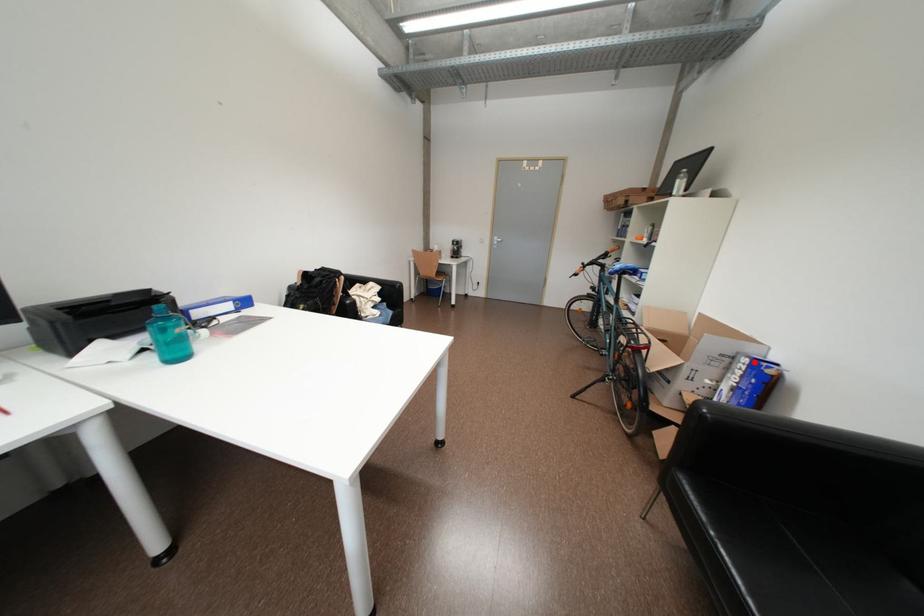
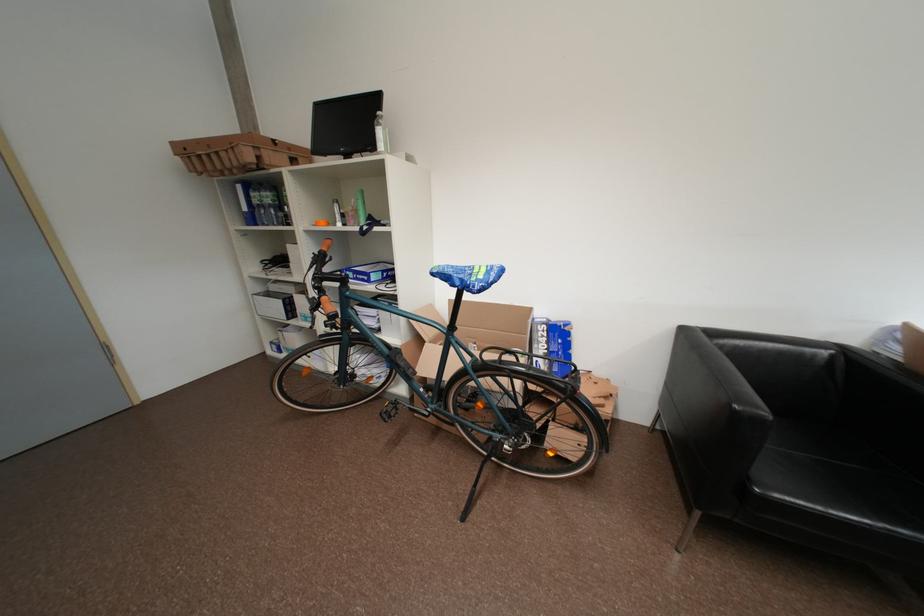
Question: I am providing you with two images of the same scene from different viewpoints. A red point is shown in image1. For the corresponding object point in image2, is it positioned nearer or farther from the camera?

Choices:
 (A) Nearer
 (B) Farther

Answer: (B)